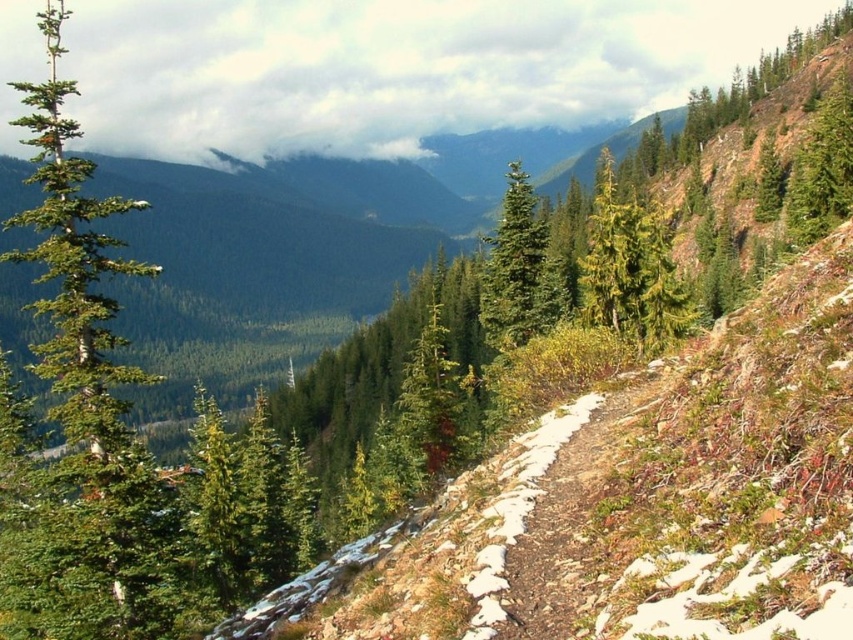
Can you confirm if green matte tree at left is shorter than green matte tree at center?

Incorrect, green matte tree at left's height does not fall short of green matte tree at center's.

I want to click on green matte tree at left, so click(91, 388).

Who is more distant from viewer, (x=143, y=532) or (x=491, y=298)?

The point (x=491, y=298) is behind.

You are a GUI agent. You are given a task and a screenshot of the screen. Output one action in this format:
    pyautogui.click(x=<x>, y=<y>)
    Task: Click on the green matte tree at left
    The height and width of the screenshot is (640, 853).
    Given the screenshot: What is the action you would take?
    pyautogui.click(x=91, y=388)

Consider the image. Between green matte tree at left and green textured tree at upper right, which one appears on the right side from the viewer's perspective?

Positioned to the right is green textured tree at upper right.

This screenshot has height=640, width=853. Identify the location of green matte tree at left. (91, 388).

Is green matte tree at center wider than green textured tree at upper right?

Incorrect, green matte tree at center's width does not surpass green textured tree at upper right's.

Is green matte tree at center closer to camera compared to green textured tree at upper right?

Yes, it is.

Who is more distant from viewer, (500, 340) or (842, 81)?

The point (842, 81) is more distant.

At what (x,y) coordinates should I click in order to perform the action: click on green matte tree at center. Please return your answer as a coordinate pair (x, y). This screenshot has height=640, width=853. Looking at the image, I should click on pos(519,269).